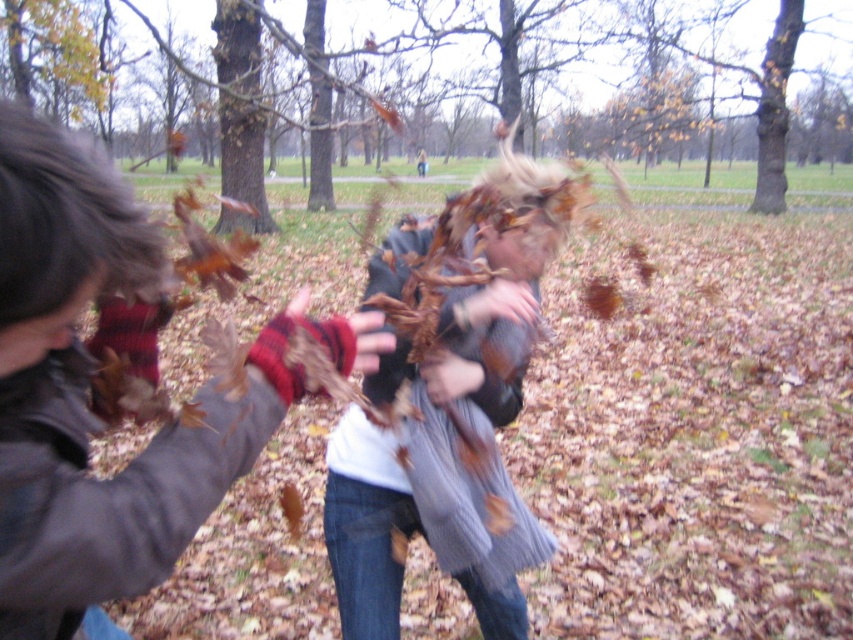
Is plaid wool mittens at left wider than gray knitted sweater at center?

No.

Which is behind, point (137, 547) or point (474, 305)?

Positioned behind is point (474, 305).

Image resolution: width=853 pixels, height=640 pixels. What do you see at coordinates (88, 385) in the screenshot? I see `plaid wool mittens at left` at bounding box center [88, 385].

The width and height of the screenshot is (853, 640). I want to click on plaid wool mittens at left, so click(88, 385).